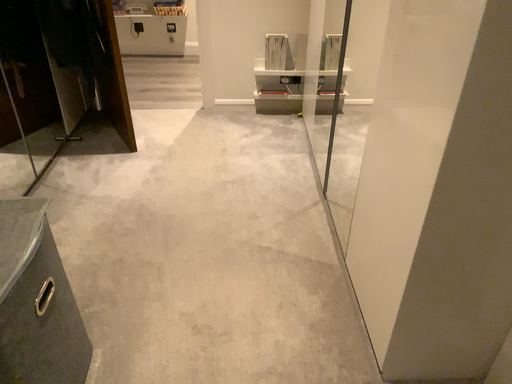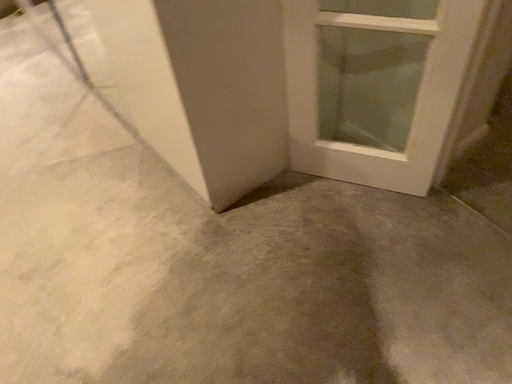
Question: Which way did the camera rotate in the video?

Choices:
 (A) rotated upward
 (B) rotated downward

Answer: (B)